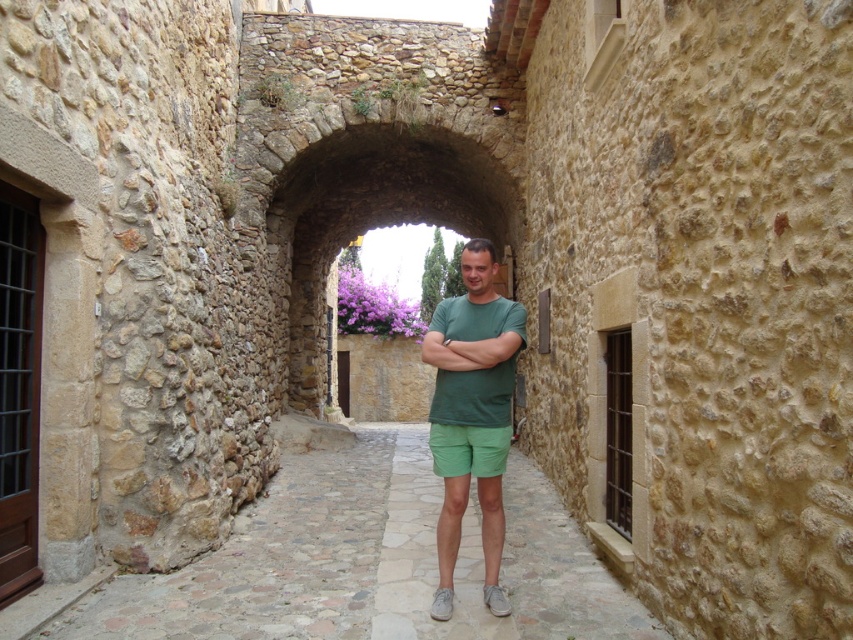
Based on the photo, does smooth stone alley at center have a greater height compared to green matte shirt at center?

No, smooth stone alley at center is not taller than green matte shirt at center.

Describe the element at coordinates (369, 563) in the screenshot. I see `smooth stone alley at center` at that location.

Does point (345, 524) come in front of point (445, 346)?

No, it is not.

The width and height of the screenshot is (853, 640). Identify the location of smooth stone alley at center. (369, 563).

Who is higher up, smooth stone alley at center or stone archway at center?

stone archway at center is higher up.

Does smooth stone alley at center have a lesser height compared to stone archway at center?

Correct, smooth stone alley at center is not as tall as stone archway at center.

Where is `smooth stone alley at center`? The width and height of the screenshot is (853, 640). smooth stone alley at center is located at coordinates (369, 563).

Can you confirm if stone archway at center is positioned below green cotton t-shirt at center?

No.

Who is taller, stone archway at center or green cotton t-shirt at center?

With more height is green cotton t-shirt at center.

Does point (509, 211) come closer to viewer compared to point (439, 602)?

That is False.

You are a GUI agent. You are given a task and a screenshot of the screen. Output one action in this format:
    pyautogui.click(x=<x>, y=<y>)
    Task: Click on the stone archway at center
    This screenshot has height=640, width=853.
    Given the screenshot: What is the action you would take?
    pyautogui.click(x=376, y=212)